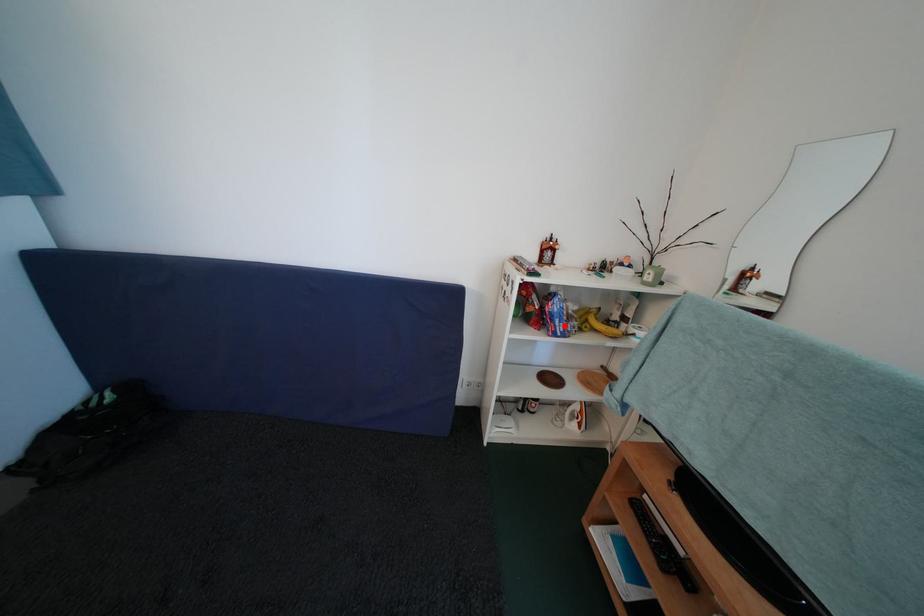
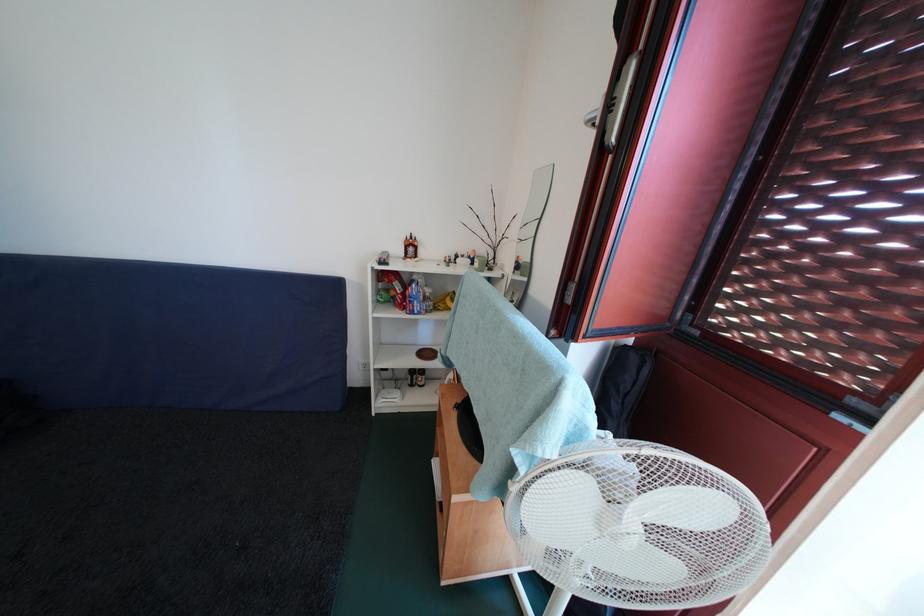
In the second image, find the point that corresponds to the highlighted location in the first image.

(422, 307)